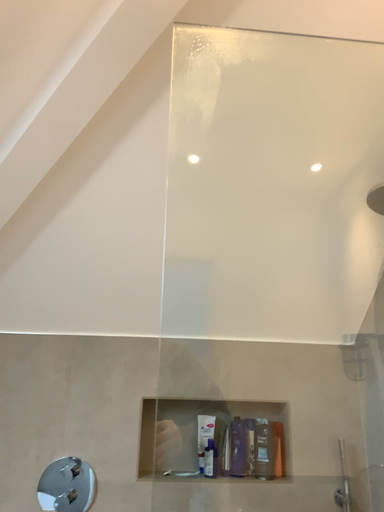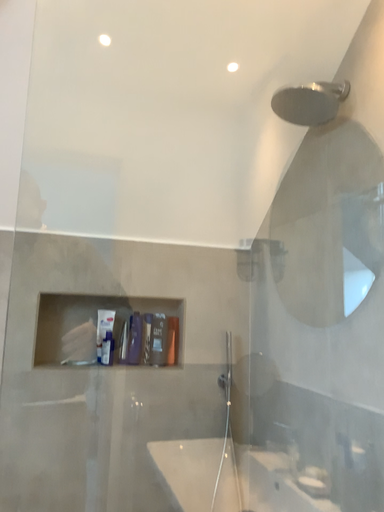
Question: How did the camera likely rotate when shooting the video?

Choices:
 (A) rotated downward
 (B) rotated upward

Answer: (A)